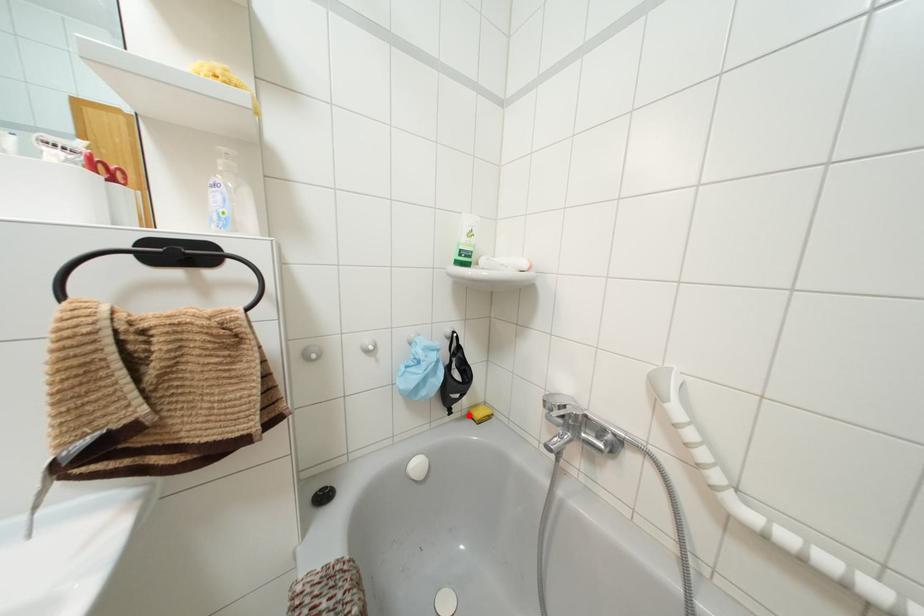
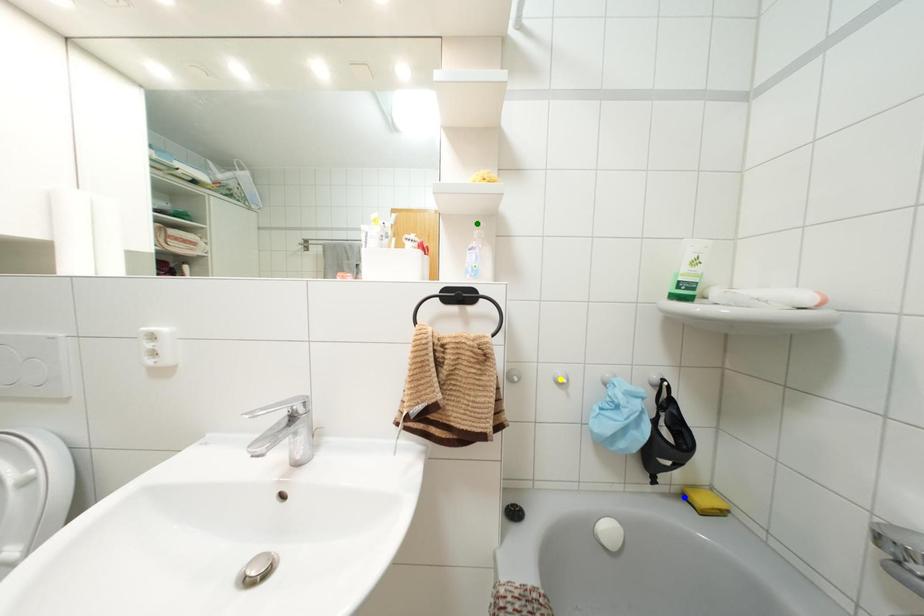
Question: I am providing you with two images of the same scene from different viewpoints. A red point is marked on the first image. You are given multiple points on the second image. Which point in image 2 is actually the same real-world point as the red point in image 1?

Choices:
 (A) yellow point
 (B) green point
 (C) blue point

Answer: (C)